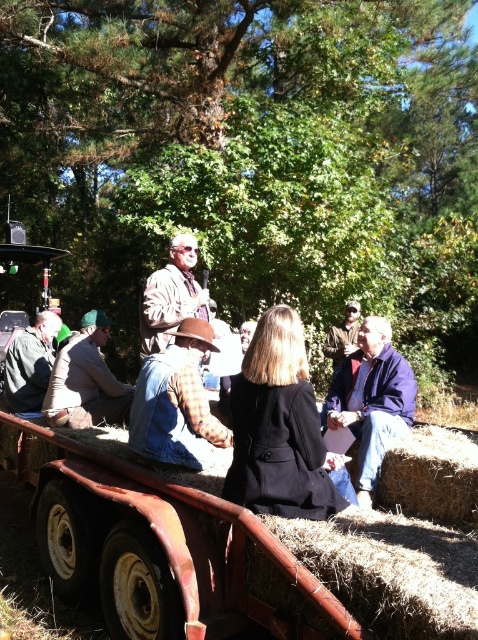
Between brown leather hat at center and denim jacket at lower left, which one has more height?

Standing taller between the two is brown leather hat at center.

Which of these two, brown leather hat at center or denim jacket at lower left, stands shorter?

denim jacket at lower left

Where is `brown leather hat at center`? This screenshot has height=640, width=478. brown leather hat at center is located at coordinates (171, 296).

You are a GUI agent. You are given a task and a screenshot of the screen. Output one action in this format:
    pyautogui.click(x=<x>, y=<y>)
    Task: Click on the brown leather hat at center
    The width and height of the screenshot is (478, 640).
    Given the screenshot: What is the action you would take?
    pyautogui.click(x=171, y=296)

Between brown denim vest at center and denim jacket at lower left, which one is positioned higher?

denim jacket at lower left is higher up.

Can you confirm if brown denim vest at center is taller than denim jacket at lower left?

Indeed, brown denim vest at center has a greater height compared to denim jacket at lower left.

Is point (174, 444) in front of point (19, 336)?

Yes, point (174, 444) is in front of point (19, 336).

This screenshot has height=640, width=478. I want to click on brown denim vest at center, so click(x=177, y=404).

Does blue denim jacket at lower right have a lesser height compared to denim jacket at lower left?

Incorrect, blue denim jacket at lower right's height does not fall short of denim jacket at lower left's.

Between blue denim jacket at lower right and denim jacket at lower left, which one has more height?

blue denim jacket at lower right

Find the location of `blue denim jacket at lower right`. blue denim jacket at lower right is located at coordinates (371, 401).